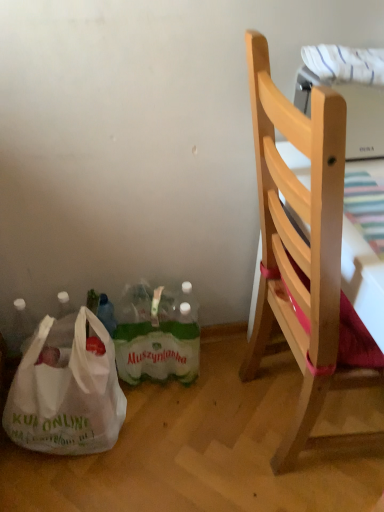
Question: Considering the relative sizes of white plastic bag at lower left and natural wood chair at right in the image provided, is white plastic bag at lower left thinner than natural wood chair at right?

Choices:
 (A) no
 (B) yes

Answer: (B)

Question: From the image's perspective, is white plastic bag at lower left located beneath natural wood chair at right?

Choices:
 (A) no
 (B) yes

Answer: (B)

Question: Does white plastic bag at lower left touch natural wood chair at right?

Choices:
 (A) no
 (B) yes

Answer: (A)

Question: Is white plastic bag at lower left completely or partially outside of natural wood chair at right?

Choices:
 (A) yes
 (B) no

Answer: (A)

Question: Is white plastic bag at lower left shorter than natural wood chair at right?

Choices:
 (A) no
 (B) yes

Answer: (B)

Question: Is white plastic bag at lower left positioned behind natural wood chair at right?

Choices:
 (A) no
 (B) yes

Answer: (B)

Question: Can you confirm if green plastic bottles at lower center is positioned to the left of natural wood chair at right?

Choices:
 (A) yes
 (B) no

Answer: (A)

Question: Does green plastic bottles at lower center appear on the right side of natural wood chair at right?

Choices:
 (A) no
 (B) yes

Answer: (A)

Question: Is green plastic bottles at lower center taller than natural wood chair at right?

Choices:
 (A) no
 (B) yes

Answer: (A)

Question: Could you tell me if green plastic bottles at lower center is facing natural wood chair at right?

Choices:
 (A) yes
 (B) no

Answer: (B)

Question: Considering the relative sizes of green plastic bottles at lower center and natural wood chair at right in the image provided, is green plastic bottles at lower center thinner than natural wood chair at right?

Choices:
 (A) no
 (B) yes

Answer: (B)

Question: Is the depth of green plastic bottles at lower center less than that of natural wood chair at right?

Choices:
 (A) no
 (B) yes

Answer: (A)

Question: Is natural wood chair at right facing towards white plastic bag at lower left?

Choices:
 (A) yes
 (B) no

Answer: (B)